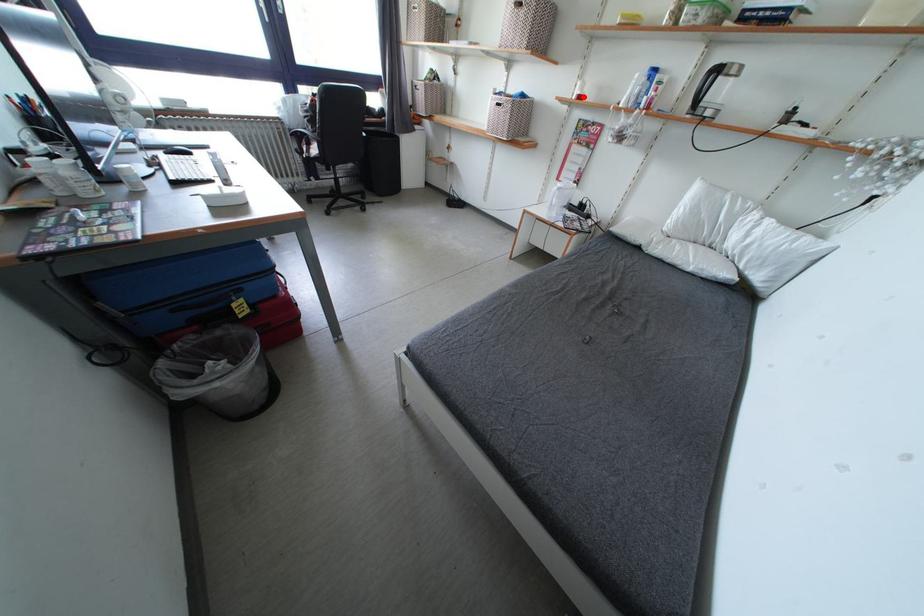
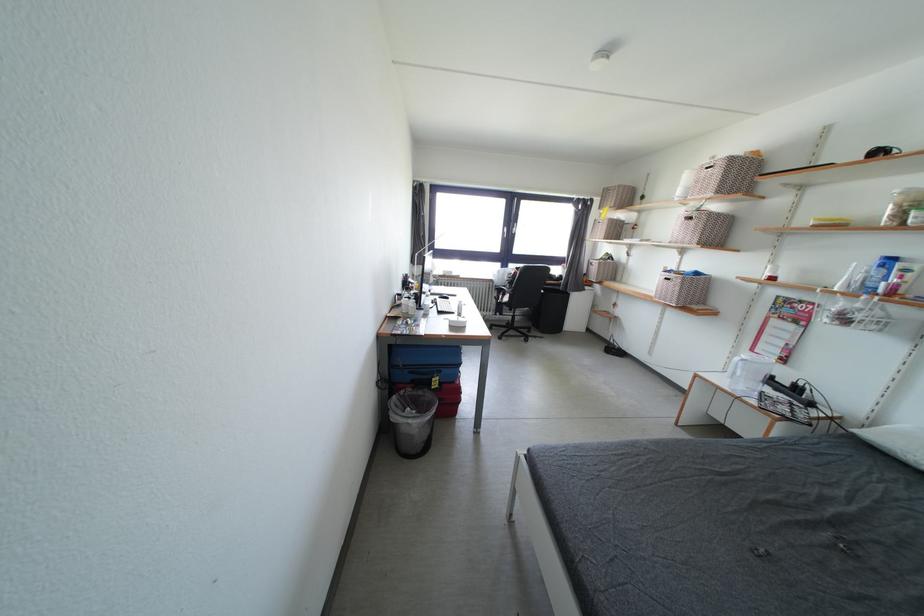
Locate, in the second image, the point that corresponds to the highlighted location in the first image.

(773, 278)